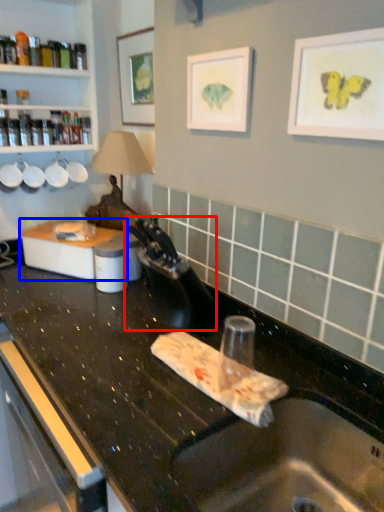
Question: Which object is closer to the camera taking this photo, faucet (highlighted by a red box) or appliance (highlighted by a blue box)?

Choices:
 (A) faucet
 (B) appliance

Answer: (A)